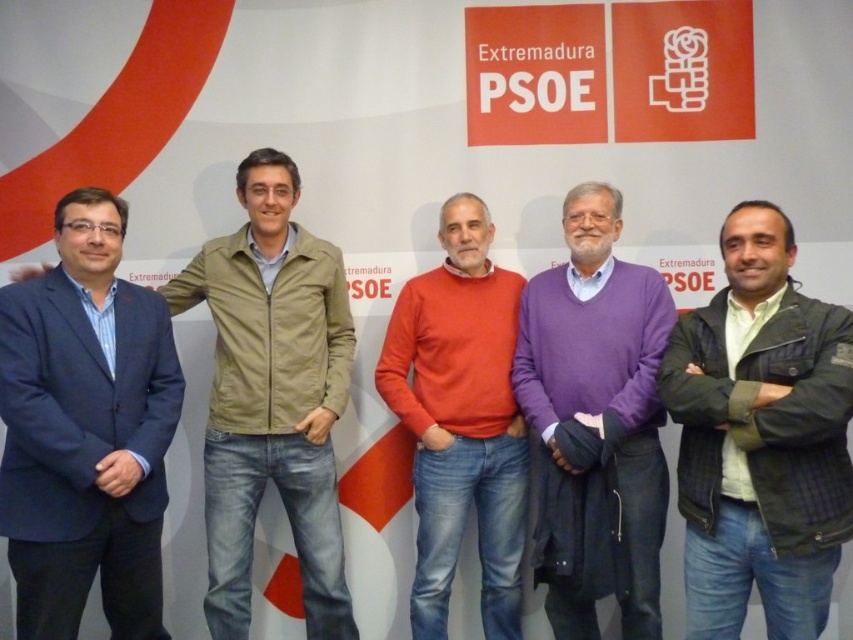
Is blue fabric suit at left thinner than green plaid jacket at center?

Yes, blue fabric suit at left is thinner than green plaid jacket at center.

Is point (61, 349) closer to viewer compared to point (677, 376)?

Yes.

Which is in front, point (62, 410) or point (809, 429)?

Point (809, 429)

Where is `blue fabric suit at left`? blue fabric suit at left is located at coordinates (85, 432).

In the scene shown: Is blue fabric suit at left positioned before purple sweater at center?

Yes, blue fabric suit at left is closer to the viewer.

Measure the distance between point (0, 522) and camera.

Point (0, 522) is 2.44 meters from camera.

Between point (154, 305) and point (630, 620), which one is positioned behind?

Positioned behind is point (630, 620).

Identify the location of blue fabric suit at left. click(x=85, y=432).

Is point (280, 339) positioned in front of point (450, 358)?

Yes, it is.

Is khaki fabric jacket at left to the right of matte orange sweater at center from the viewer's perspective?

In fact, khaki fabric jacket at left is to the left of matte orange sweater at center.

Where is `khaki fabric jacket at left`? khaki fabric jacket at left is located at coordinates (271, 396).

Image resolution: width=853 pixels, height=640 pixels. I want to click on khaki fabric jacket at left, so click(271, 396).